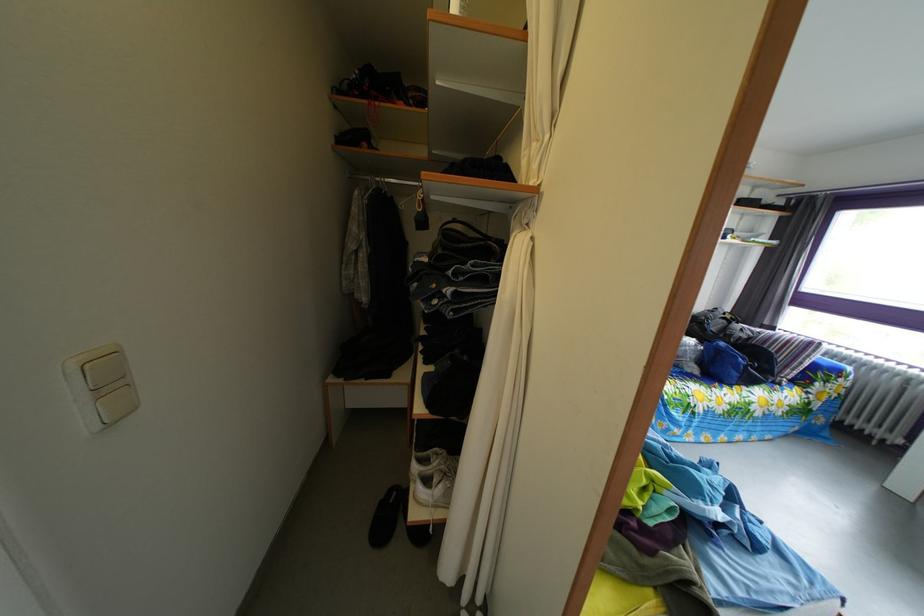
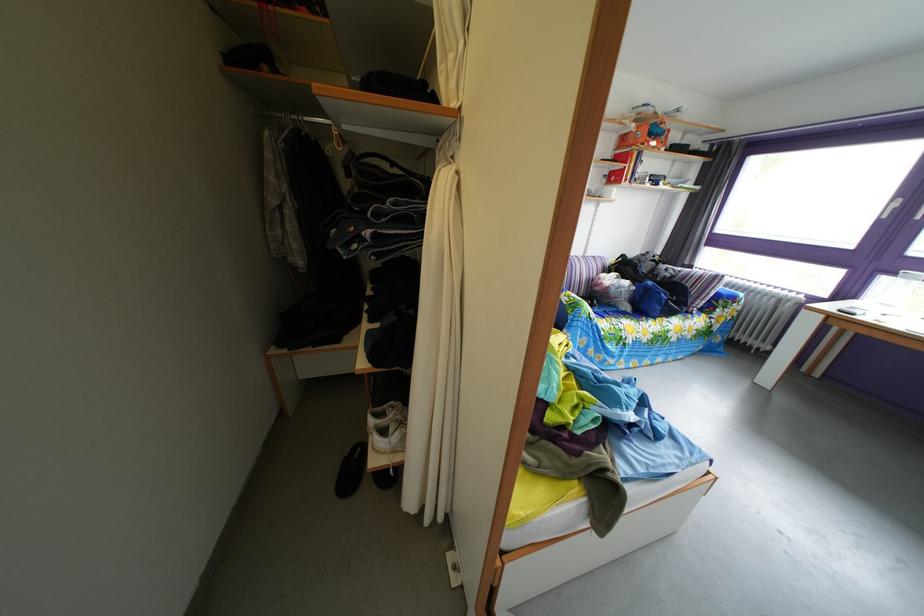
In the second image, find the point that corresponds to (x=704, y=377) in the first image.

(638, 315)